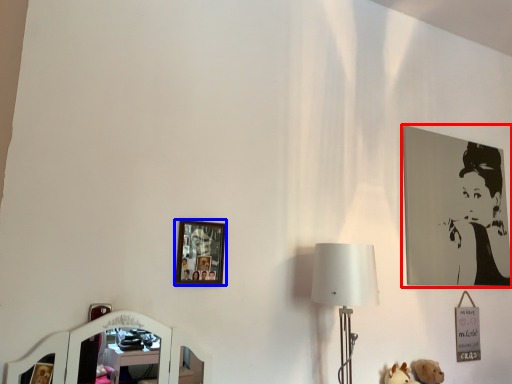
Question: Among these objects, which one is nearest to the camera, picture frame (highlighted by a red box) or picture frame (highlighted by a blue box)?

Choices:
 (A) picture frame
 (B) picture frame

Answer: (B)